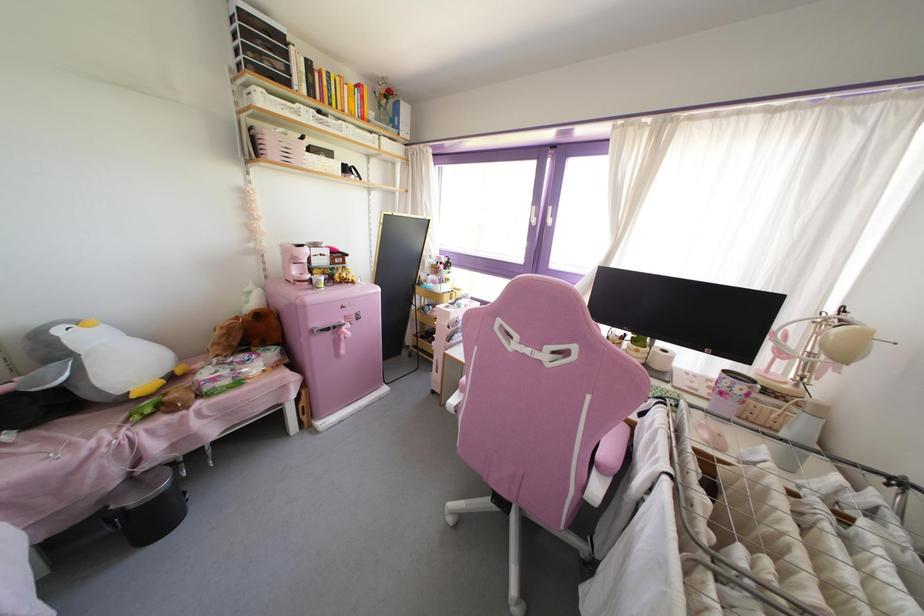
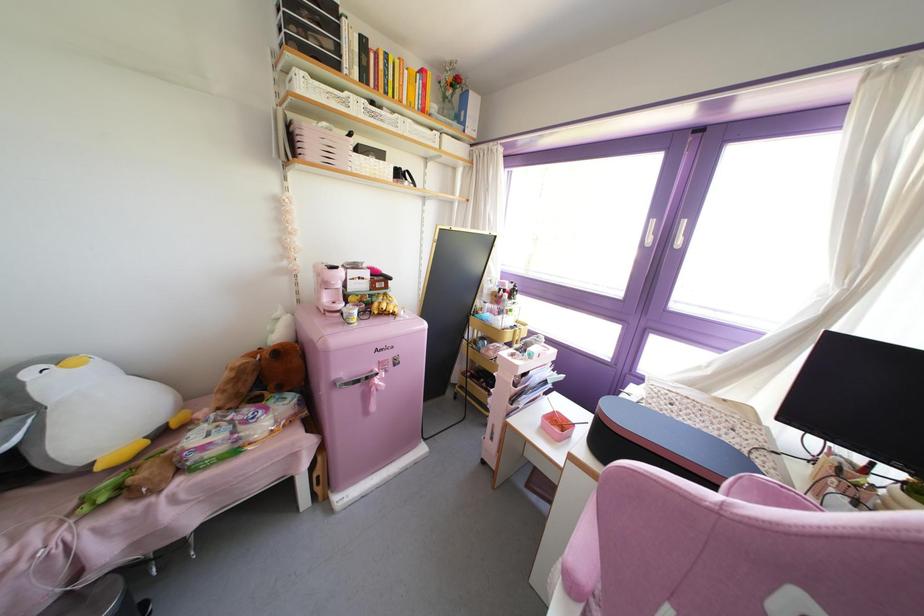
Where in the second image is the point corresponding to (x=324, y=89) from the first image?

(381, 74)